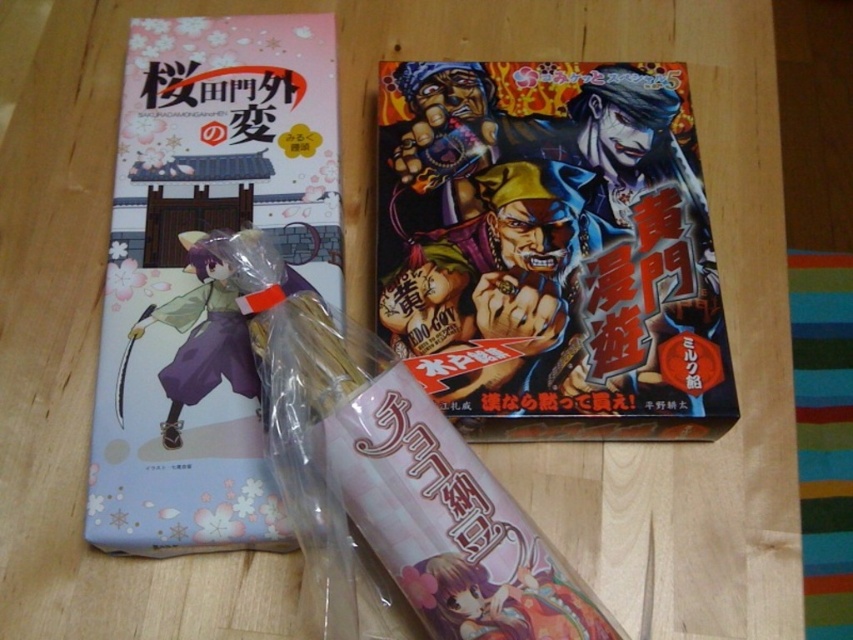
Question: Can you confirm if matte paper comic book at center is thinner than matte paper comic book at left?

Choices:
 (A) yes
 (B) no

Answer: (B)

Question: Which is nearer to the purple matte figure at center?

Choices:
 (A) matte paper comic book at center
 (B) matte paper comic book at left

Answer: (B)

Question: Does matte paper comic book at left appear on the left side of purple matte figure at center?

Choices:
 (A) yes
 (B) no

Answer: (B)

Question: Is matte paper comic book at left positioned at the back of purple matte figure at center?

Choices:
 (A) no
 (B) yes

Answer: (A)

Question: Among these points, which one is nearest to the camera?

Choices:
 (A) 236,124
 (B) 222,269
 (C) 590,134

Answer: (B)

Question: Which point is farther to the camera?

Choices:
 (A) (643, 433)
 (B) (225, 301)
 (C) (142, 416)

Answer: (B)